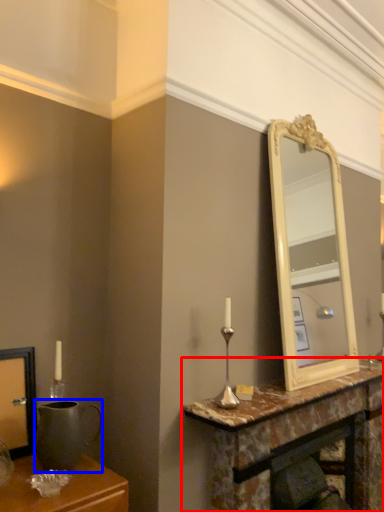
Question: Which of the following is the closest to the observer, table (highlighted by a red box) or gray (highlighted by a blue box)?

Choices:
 (A) table
 (B) gray

Answer: (B)